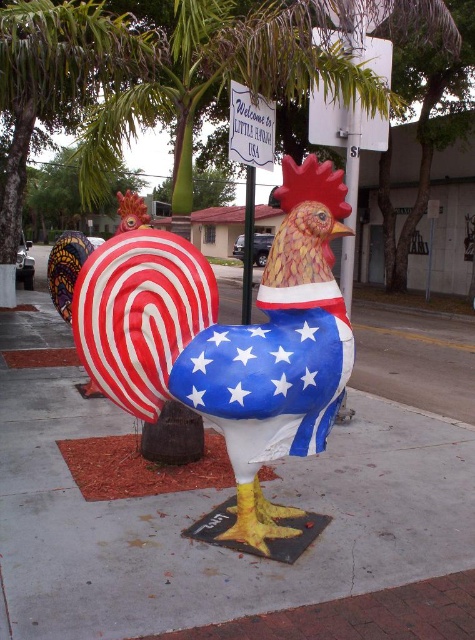
Question: Estimate the real-world distances between objects in this image. Which object is closer to the white plastic sign at upper center?

Choices:
 (A) metallic pole at center
 (B) painted fabric rooster at center

Answer: (A)

Question: Considering the real-world distances, which object is closest to the painted fabric rooster at center?

Choices:
 (A) metallic pole at center
 (B) painted concrete sidewalk at center
 (C) white plastic sign at upper center

Answer: (B)

Question: From the image, what is the correct spatial relationship of painted concrete sidewalk at center in relation to metallic pole at center?

Choices:
 (A) right
 (B) left

Answer: (A)

Question: Does painted fabric rooster at center have a greater width compared to white plastic sign at upper center?

Choices:
 (A) yes
 (B) no

Answer: (A)

Question: Is painted concrete sidewalk at center to the right of painted fabric rooster at center from the viewer's perspective?

Choices:
 (A) yes
 (B) no

Answer: (A)

Question: Based on their relative distances, which object is nearer to the white plastic sign at upper center?

Choices:
 (A) metallic pole at center
 (B) painted fabric rooster at center

Answer: (A)